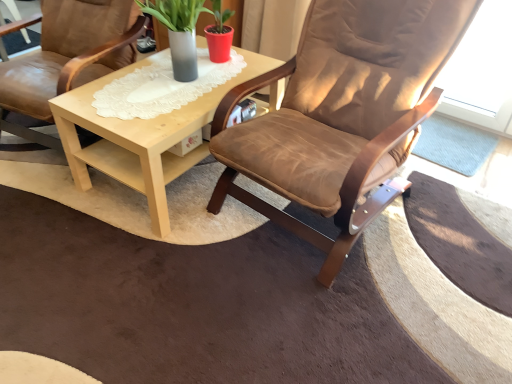
Question: Which direction should I rotate to look at brown suede chair at center, the second chair when ordered from left to right, — up or down?

Choices:
 (A) down
 (B) up

Answer: (B)

Question: Does matte gray vase at center have a smaller size compared to brown leather chair at center, acting as the second chair starting from the right?

Choices:
 (A) no
 (B) yes

Answer: (B)

Question: Can you confirm if matte gray vase at center is wider than brown leather chair at center, marked as the first chair in a left-to-right arrangement?

Choices:
 (A) yes
 (B) no

Answer: (B)

Question: Is matte gray vase at center positioned beyond the bounds of brown leather chair at center, marked as the first chair in a left-to-right arrangement?

Choices:
 (A) yes
 (B) no

Answer: (A)

Question: Is matte gray vase at center bigger than brown leather chair at center, marked as the first chair in a left-to-right arrangement?

Choices:
 (A) yes
 (B) no

Answer: (B)

Question: Is matte gray vase at center at the right side of brown leather chair at center, marked as the first chair in a left-to-right arrangement?

Choices:
 (A) yes
 (B) no

Answer: (A)

Question: Is matte gray vase at center facing towards brown leather chair at center, marked as the first chair in a left-to-right arrangement?

Choices:
 (A) no
 (B) yes

Answer: (A)

Question: From the image's perspective, does light wood/texture coffee table at center appear lower than brown leather chair at center, acting as the second chair starting from the right?

Choices:
 (A) yes
 (B) no

Answer: (A)

Question: Is light wood/texture coffee table at center to the left of brown leather chair at center, acting as the second chair starting from the right, from the viewer's perspective?

Choices:
 (A) no
 (B) yes

Answer: (A)

Question: Is light wood/texture coffee table at center positioned with its back to brown leather chair at center, acting as the second chair starting from the right?

Choices:
 (A) yes
 (B) no

Answer: (B)

Question: Is light wood/texture coffee table at center positioned before brown leather chair at center, acting as the second chair starting from the right?

Choices:
 (A) no
 (B) yes

Answer: (A)

Question: Does light wood/texture coffee table at center appear on the right side of brown leather chair at center, acting as the second chair starting from the right?

Choices:
 (A) yes
 (B) no

Answer: (A)

Question: Is light wood/texture coffee table at center touching brown leather chair at center, acting as the second chair starting from the right?

Choices:
 (A) yes
 (B) no

Answer: (B)

Question: From a real-world perspective, is brown leather chair at center, marked as the first chair in a left-to-right arrangement, over matte gray vase at center?

Choices:
 (A) yes
 (B) no

Answer: (B)